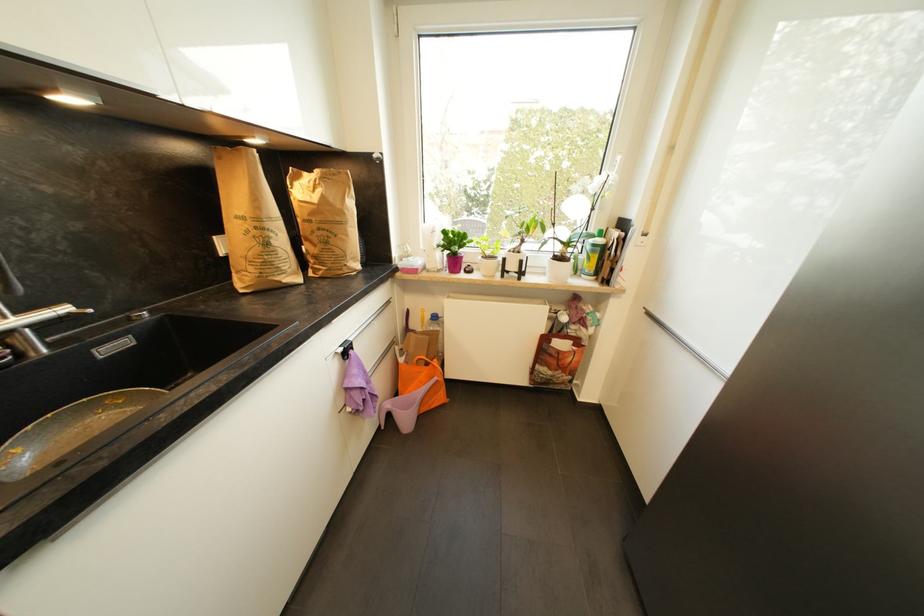
Find where to lift the orange tote bag. Please return your answer as a coordinate pair (x, y).

(421, 381)